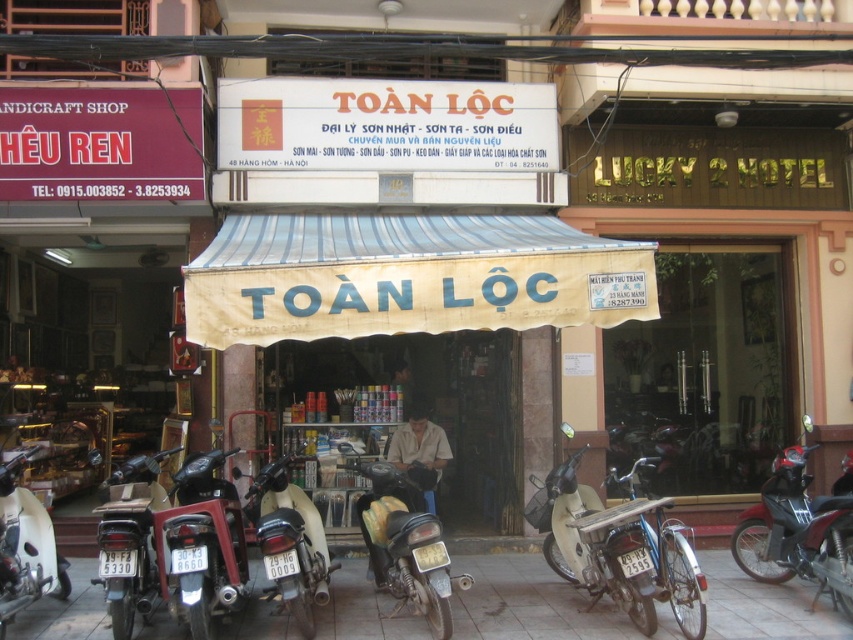
Question: Which object appears closest to the camera in this image?

Choices:
 (A) metallic silver motorcycle at center
 (B) shiny red motorcycle at lower right

Answer: (A)

Question: From the image, what is the correct spatial relationship of shiny black motorcycle at center in relation to matte black motorcycle at center?

Choices:
 (A) right
 (B) left

Answer: (A)

Question: Which object appears farthest from the camera in this image?

Choices:
 (A) white matte motorcycle at lower left
 (B) shiny black motorcycle at center
 (C) metallic silver motorcycle at center
 (D) gray concrete pavement at lower center

Answer: (D)

Question: Which of the following is the closest to the observer?

Choices:
 (A) (764, 609)
 (B) (154, 481)
 (C) (4, 480)

Answer: (C)

Question: From the image, what is the correct spatial relationship of metallic silver motorcycle at center in relation to shiny black motorcycle at center?

Choices:
 (A) above
 (B) below

Answer: (A)

Question: Can you confirm if gray concrete pavement at lower center is bigger than shiny red motorcycle at lower right?

Choices:
 (A) yes
 (B) no

Answer: (B)